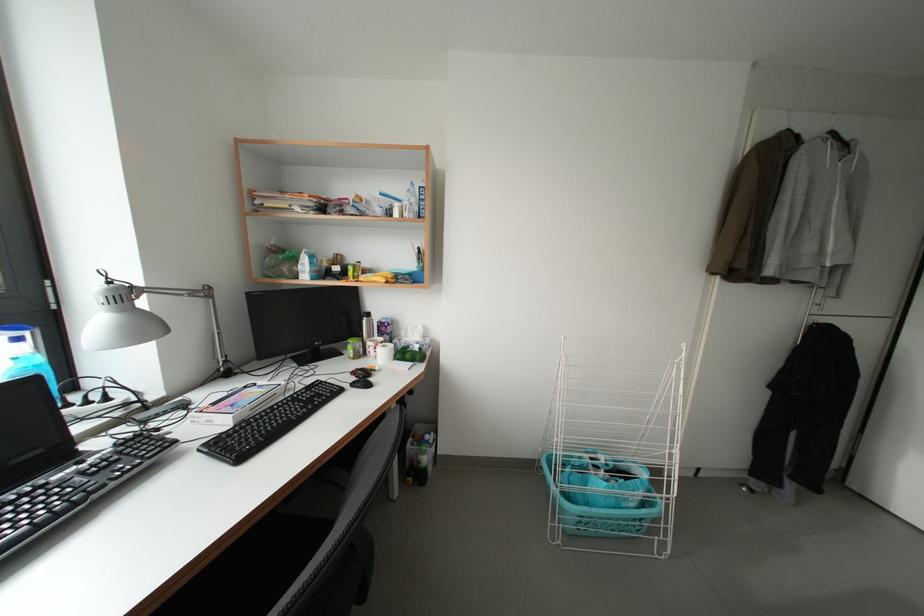
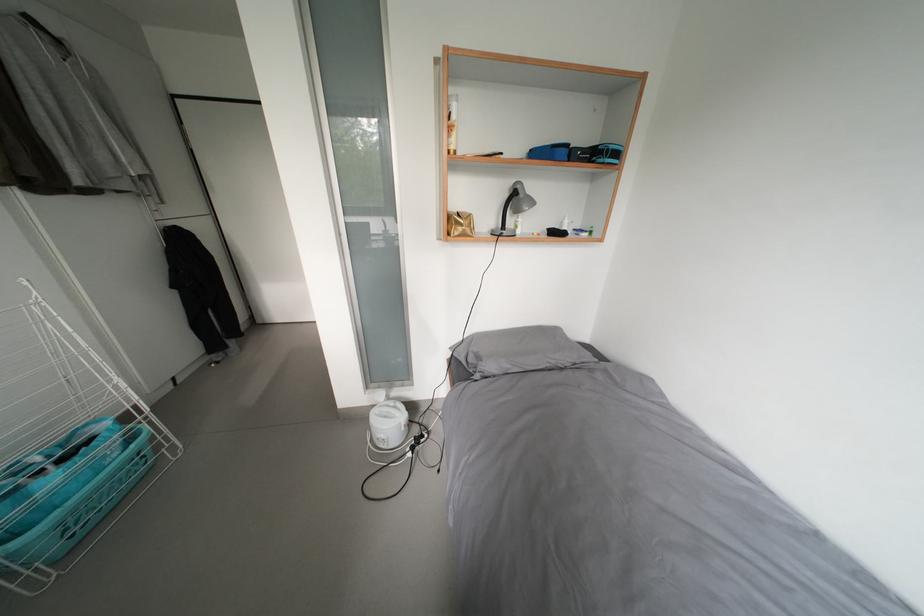
The point at (650, 516) is marked in the first image. Where is the corresponding point in the second image?

(140, 451)